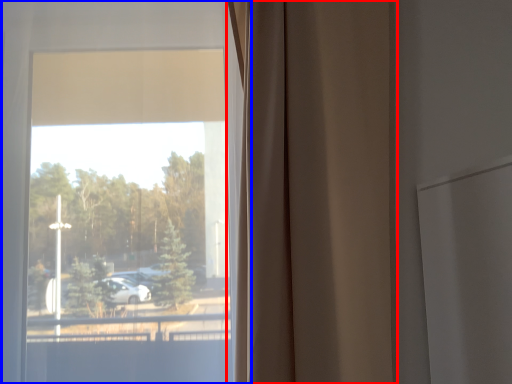
Question: Which object is further to the camera taking this photo, curtain (highlighted by a red box) or window (highlighted by a blue box)?

Choices:
 (A) curtain
 (B) window

Answer: (B)